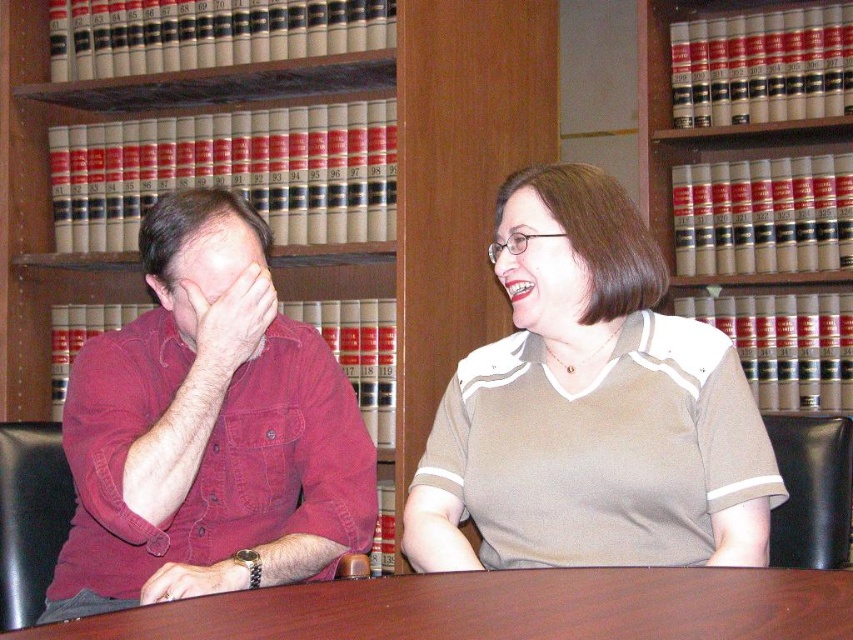
You are an observer in the library. You notice the red shirt at left and the brown wood table at center. Which object takes up more space in the image?

The red shirt at left takes up more space in the image than the brown wood table at center because it is bigger.

You are a visitor in the library and want to locate the red shirt at left. Which direction should you look relative to the wooden bookshelf at center?

The red shirt at left is below the wooden bookshelf at center, so you should look downward from the wooden bookshelf at center to find the red shirt at left.